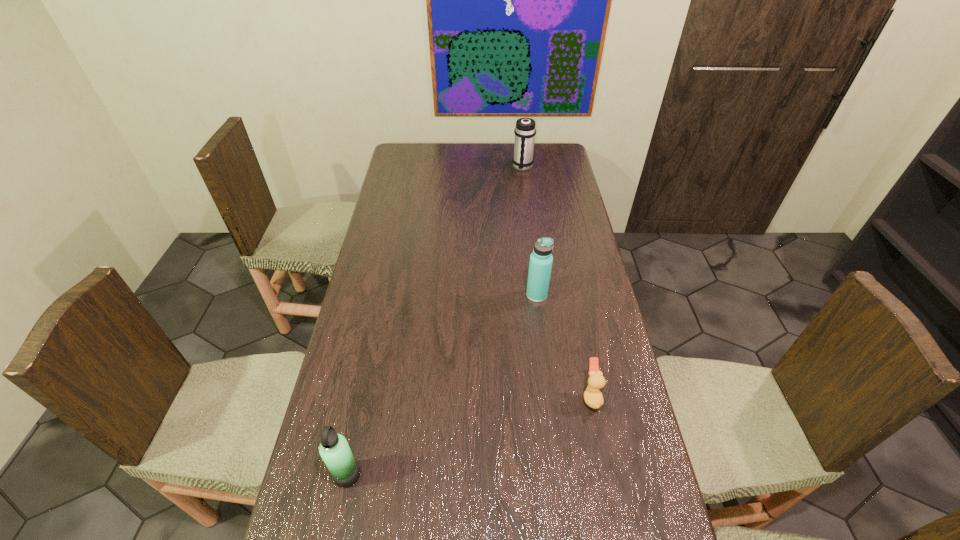
The height and width of the screenshot is (540, 960). Identify the location of free location located 0.070m on the beak of the third farthest object. 557,396.

Identify the location of vacant space situated on the beak of the third farthest object. (491, 396).

Locate an element on the screen. object positioned at the far edge is located at coordinates (525, 130).

This screenshot has height=540, width=960. I want to click on object located at the left edge, so click(x=334, y=449).

Where is `object at the right edge`? object at the right edge is located at coordinates (593, 397).

At what (x,y) coordinates should I click in order to perform the action: click on vacant region at the far edge of the desktop. Please return your answer as a coordinate pair (x, y). Image resolution: width=960 pixels, height=540 pixels. Looking at the image, I should click on (456, 166).

The width and height of the screenshot is (960, 540). In the image, there is a desktop. What are the coordinates of `free space at the left edge` in the screenshot? It's located at (398, 329).

The height and width of the screenshot is (540, 960). What are the coordinates of `vacant region at the right edge of the desktop` in the screenshot? It's located at (575, 198).

I want to click on empty space between the nearest thermos bottle and the second nearest thermos bottle, so click(x=443, y=385).

Image resolution: width=960 pixels, height=540 pixels. Find the location of `free space between the third farthest object and the leftmost object`. free space between the third farthest object and the leftmost object is located at coordinates (469, 436).